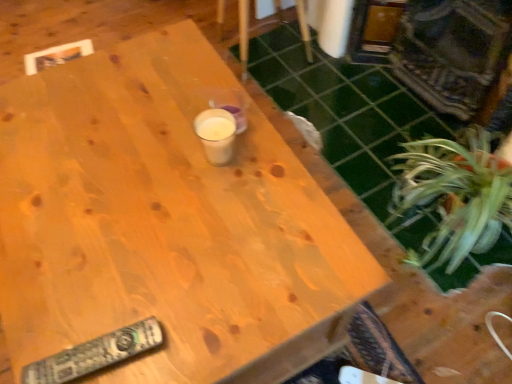
Image resolution: width=512 pixels, height=384 pixels. I want to click on vacant space situated on the left part of black plastic remote at lower left, so click(32, 327).